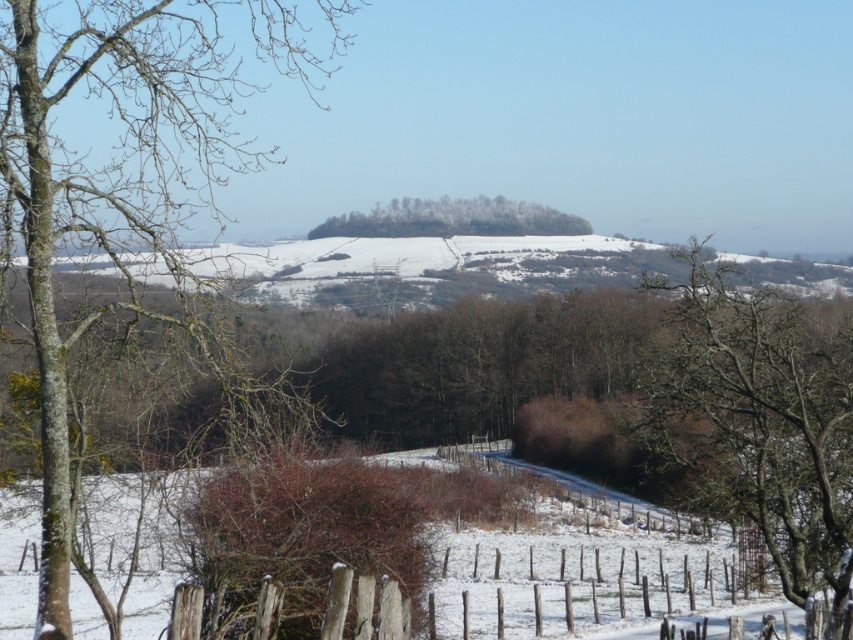
Can you confirm if bare branches at center is shorter than snow-covered trees at center?

In fact, bare branches at center may be taller than snow-covered trees at center.

Is bare branches at center taller than snow-covered trees at center?

Correct, bare branches at center is much taller as snow-covered trees at center.

Locate an element on the screen. The height and width of the screenshot is (640, 853). bare branches at center is located at coordinates (762, 420).

Identify the location of bare branches at center. (762, 420).

Is bare wood tree at left to the left of bare branches at center from the viewer's perspective?

Indeed, bare wood tree at left is positioned on the left side of bare branches at center.

Image resolution: width=853 pixels, height=640 pixels. Find the location of `bare wood tree at left`. bare wood tree at left is located at coordinates (122, 166).

Find the location of a particular element. bare wood tree at left is located at coordinates (122, 166).

Can you confirm if bare wood tree at left is positioned below snow-covered trees at center?

Correct, bare wood tree at left is located below snow-covered trees at center.

Measure the distance from bare wood tree at left to snow-covered trees at center.

bare wood tree at left and snow-covered trees at center are 17.96 meters apart from each other.

Is point (228, 115) less distant than point (503, 198)?

Yes, point (228, 115) is in front of point (503, 198).

This screenshot has height=640, width=853. In order to click on bare wood tree at left in this screenshot , I will do `click(122, 166)`.